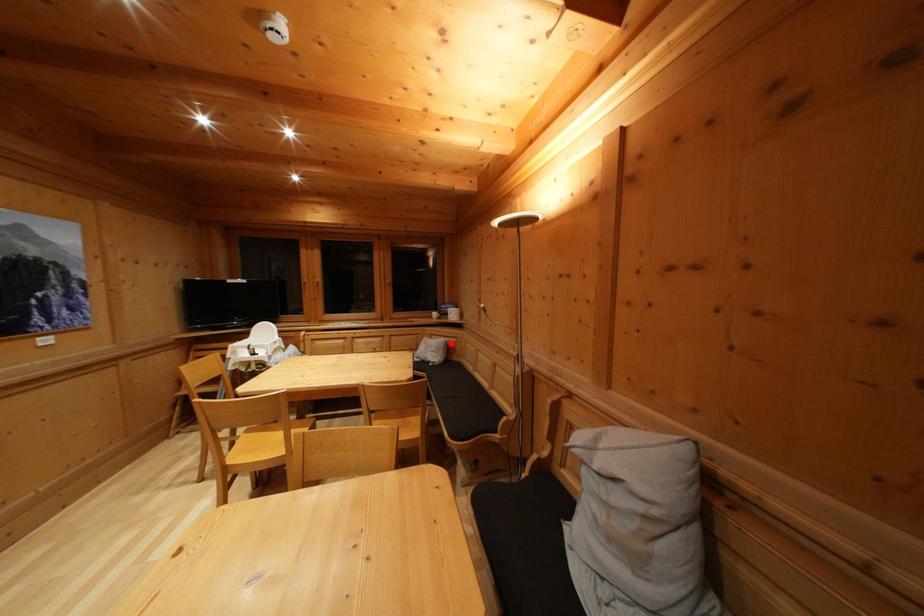
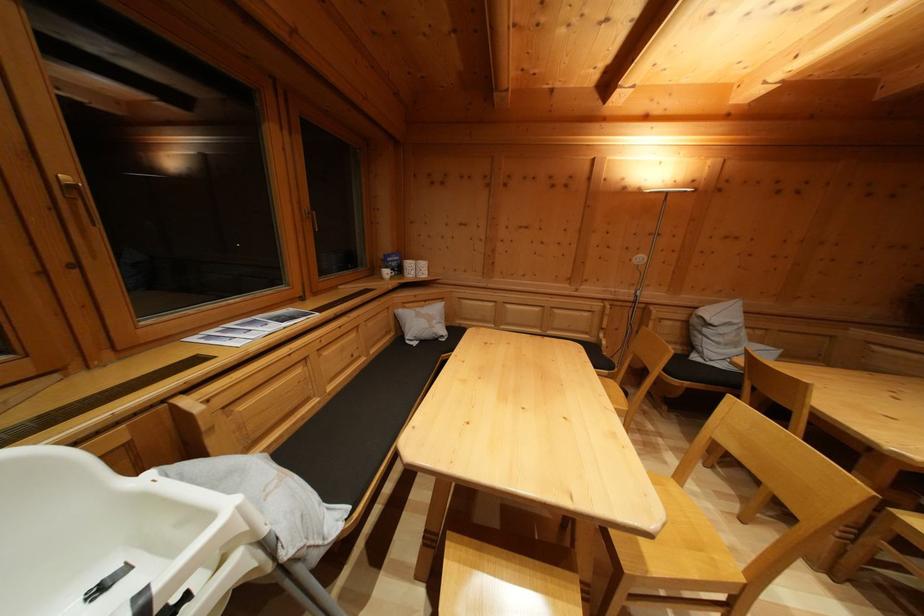
The point at the highlighted location is marked in the first image. Where is the corresponding point in the second image?

(431, 308)